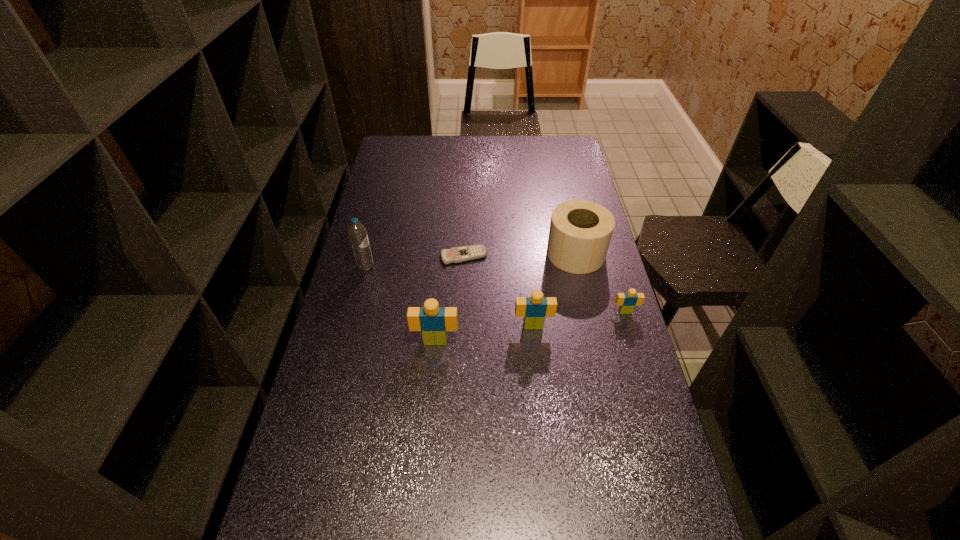
The width and height of the screenshot is (960, 540). I want to click on the nearest object, so click(x=433, y=321).

Find the location of `the nearest Lego`. the nearest Lego is located at coordinates (433, 321).

Identify the location of the fifth farthest object. (534, 309).

Image resolution: width=960 pixels, height=540 pixels. I want to click on the second farthest Lego, so click(x=534, y=309).

I want to click on the third nearest object, so click(627, 301).

Image resolution: width=960 pixels, height=540 pixels. I want to click on the farthest Lego, so click(x=627, y=301).

This screenshot has width=960, height=540. I want to click on toilet tissue, so click(580, 232).

Identify the location of the shortest object. (454, 255).

Where is `the leftmost object`? the leftmost object is located at coordinates [x=357, y=232].

Where is `water bottle`? water bottle is located at coordinates (357, 232).